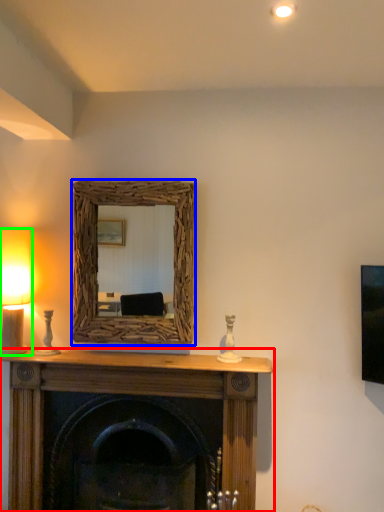
Question: Considering the real-world distances, which object is farthest from fireplace (highlighted by a red box)? picture frame (highlighted by a blue box) or table lamp (highlighted by a green box)?

Choices:
 (A) picture frame
 (B) table lamp

Answer: (B)